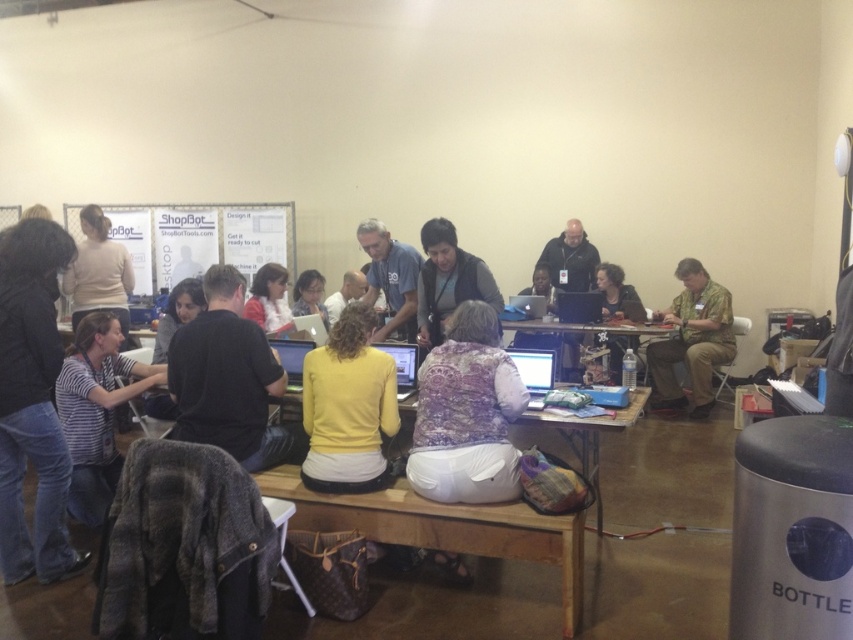
Question: Which point is closer to the camera?

Choices:
 (A) [x=660, y=390]
 (B) [x=238, y=346]

Answer: (B)

Question: Which object is farther from the camera taking this photo?

Choices:
 (A) matte black laptop at center
 (B) hemp fabric shirt at center
 (C) wooden table at center
 (D) black matte shirt at center

Answer: (B)

Question: Can you confirm if striped fabric shirt at lower left is positioned to the left of wooden table at center?

Choices:
 (A) no
 (B) yes

Answer: (B)

Question: Does yellow matte sweater at center have a larger size compared to white glossy laptop at center?

Choices:
 (A) no
 (B) yes

Answer: (B)

Question: Which object is closer to the camera taking this photo?

Choices:
 (A) black matte shirt at center
 (B) wooden table at center
 (C) yellow matte sweater at center

Answer: (C)

Question: Can you confirm if black matte shirt at center is thinner than hemp fabric shirt at center?

Choices:
 (A) yes
 (B) no

Answer: (A)